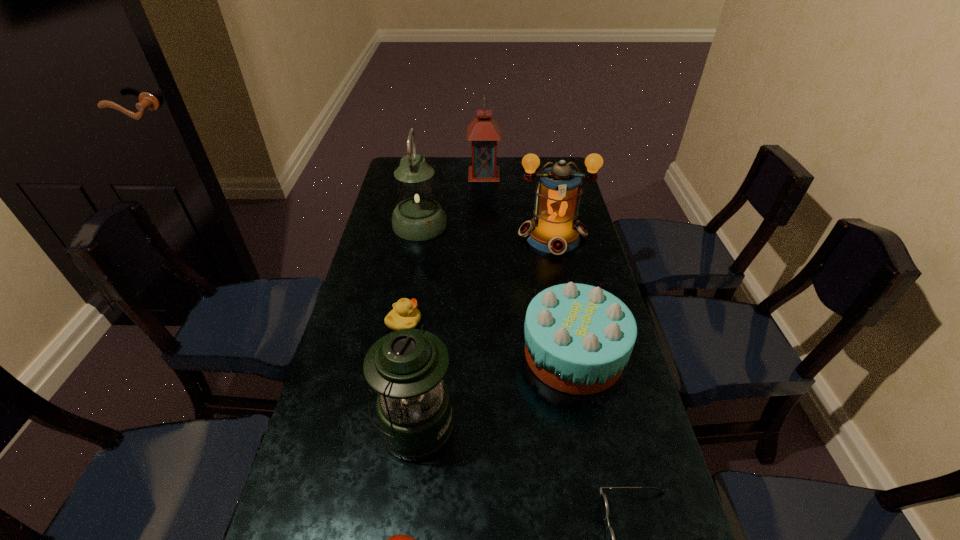
You are a GUI agent. You are given a task and a screenshot of the screen. Output one action in this format:
    pyautogui.click(x=<x>, y=<y>)
    Task: Click on the farthest object
    This screenshot has height=540, width=960.
    Given the screenshot: What is the action you would take?
    pyautogui.click(x=484, y=132)

Locate an element on the screen. the third lantern from left to right is located at coordinates (484, 132).

Where is `the rightmost lantern`? The width and height of the screenshot is (960, 540). the rightmost lantern is located at coordinates (554, 229).

You are a GUI agent. You are given a task and a screenshot of the screen. Output one action in this format:
    pyautogui.click(x=<x>, y=<y>)
    Task: Click on the nearest lantern
    This screenshot has width=960, height=540.
    Given the screenshot: What is the action you would take?
    pyautogui.click(x=406, y=368)

This screenshot has width=960, height=540. What are the coordinates of `cake` in the screenshot? It's located at (578, 338).

You are a GUI agent. You are given a task and a screenshot of the screen. Output one action in this format:
    pyautogui.click(x=<x>, y=<y>)
    Task: Click on the duckling
    This screenshot has height=540, width=960.
    Given the screenshot: What is the action you would take?
    pyautogui.click(x=405, y=315)

The image size is (960, 540). I want to click on free location located 0.230m on the left of the farthest lantern, so click(x=412, y=174).

This screenshot has height=540, width=960. In order to click on vacant area situated 0.330m on the front-facing side of the rightmost lantern in this screenshot , I will do `click(573, 338)`.

You are a GUI agent. You are given a task and a screenshot of the screen. Output one action in this format:
    pyautogui.click(x=<x>, y=<y>)
    Task: Click on the free space located 0.050m on the back of the nearest lantern
    The width and height of the screenshot is (960, 540).
    Given the screenshot: What is the action you would take?
    pyautogui.click(x=420, y=375)

Identify the location of free region located on the back of the cake. The height and width of the screenshot is (540, 960). (x=560, y=284).